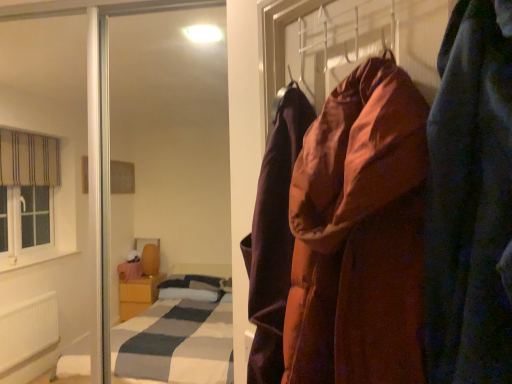
Identify the location of velvet-like brown coat at right. (404, 220).

The height and width of the screenshot is (384, 512). What do you see at coordinates (404, 220) in the screenshot? I see `velvet-like brown coat at right` at bounding box center [404, 220].

I want to click on velvet-like brown coat at right, so click(404, 220).